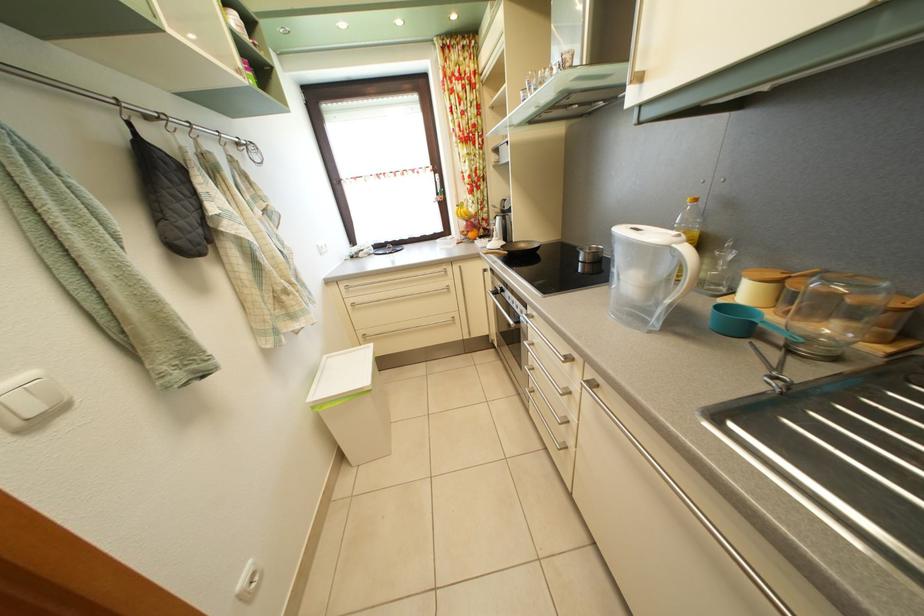
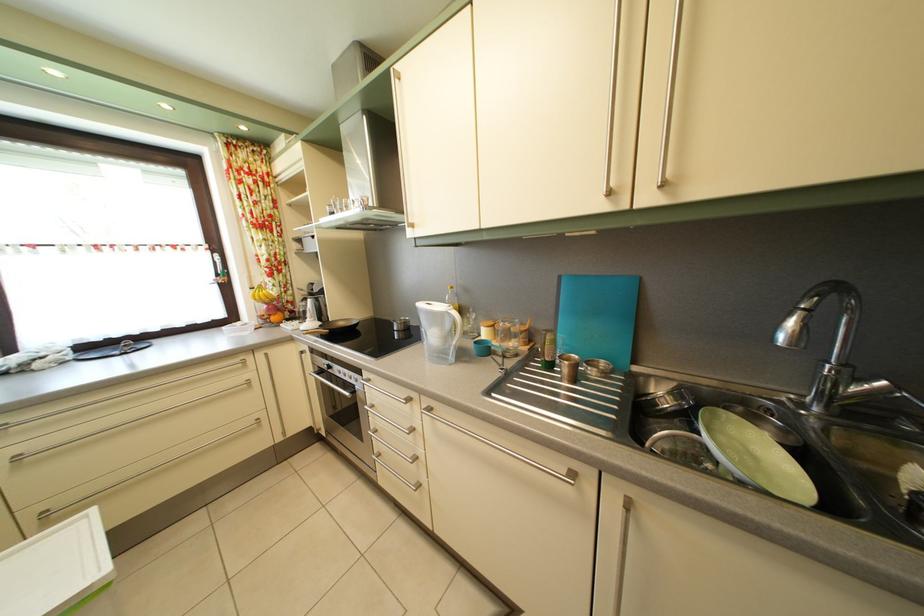
In the second image, find the point that corresponds to the point at 511,298 in the first image.

(337, 374)